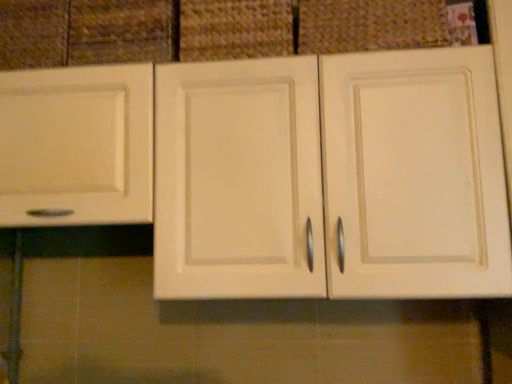
Question: Does matte white drawer at upper left come behind matte fabric basket at upper center, which appears as the 1th basket when viewed from the right?

Choices:
 (A) yes
 (B) no

Answer: (A)

Question: Considering the relative sizes of matte white drawer at upper left and matte fabric basket at upper center, which appears as the 1th basket when viewed from the right, in the image provided, is matte white drawer at upper left bigger than matte fabric basket at upper center, which appears as the 1th basket when viewed from the right,?

Choices:
 (A) no
 (B) yes

Answer: (B)

Question: Considering the relative sizes of matte white drawer at upper left and matte fabric basket at upper center, which is the second basket in left-to-right order, in the image provided, is matte white drawer at upper left smaller than matte fabric basket at upper center, which is the second basket in left-to-right order,?

Choices:
 (A) yes
 (B) no

Answer: (B)

Question: Would you say matte fabric basket at upper center, which appears as the 1th basket when viewed from the right, is part of matte white drawer at upper left's contents?

Choices:
 (A) no
 (B) yes

Answer: (A)

Question: Is matte white drawer at upper left positioned before matte fabric basket at upper center, which appears as the 1th basket when viewed from the right?

Choices:
 (A) no
 (B) yes

Answer: (A)

Question: Choose the correct answer: Is woven fabric basket at upper center, which is counted as the second basket, starting from the right, inside matte cream cabinet at center or outside it?

Choices:
 (A) outside
 (B) inside

Answer: (B)

Question: Is woven fabric basket at upper center, which is counted as the second basket, starting from the right, to the left or to the right of matte cream cabinet at center in the image?

Choices:
 (A) left
 (B) right

Answer: (A)

Question: Is woven fabric basket at upper center, which is counted as the second basket, starting from the right, in front of or behind matte cream cabinet at center in the image?

Choices:
 (A) behind
 (B) front

Answer: (A)

Question: From their relative heights in the image, would you say woven fabric basket at upper center, which is counted as the second basket, starting from the right, is taller or shorter than matte cream cabinet at center?

Choices:
 (A) short
 (B) tall

Answer: (A)

Question: From a real-world perspective, is matte white drawer at upper left physically located above or below matte fabric basket at upper center, which is the second basket in left-to-right order?

Choices:
 (A) above
 (B) below

Answer: (A)

Question: Considering the positions of matte white drawer at upper left and matte fabric basket at upper center, which appears as the 1th basket when viewed from the right, in the image, is matte white drawer at upper left wider or thinner than matte fabric basket at upper center, which appears as the 1th basket when viewed from the right,?

Choices:
 (A) wide
 (B) thin

Answer: (A)

Question: Is point (123, 46) closer or farther from the camera than point (304, 3)?

Choices:
 (A) farther
 (B) closer

Answer: (A)

Question: From the image's perspective, relative to matte fabric basket at upper center, which is the second basket in left-to-right order, is matte white drawer at upper left above or below?

Choices:
 (A) below
 (B) above

Answer: (A)

Question: From a real-world perspective, is matte cream cabinet at center above or below matte fabric basket at upper center, which is the second basket in left-to-right order?

Choices:
 (A) below
 (B) above

Answer: (A)

Question: Looking at the image, does matte cream cabinet at center seem bigger or smaller compared to matte fabric basket at upper center, which is the second basket in left-to-right order?

Choices:
 (A) big
 (B) small

Answer: (A)